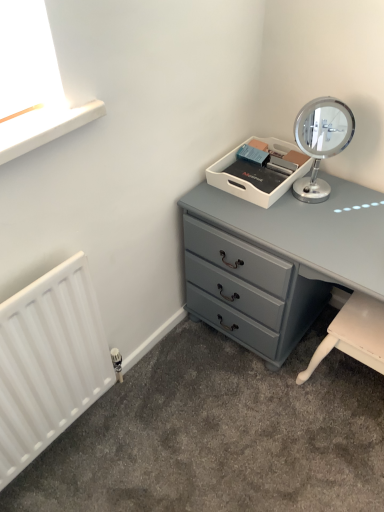
Locate an element on the screen. This screenshot has width=384, height=512. free space to the left of matte gray chest of drawers at center is located at coordinates (173, 402).